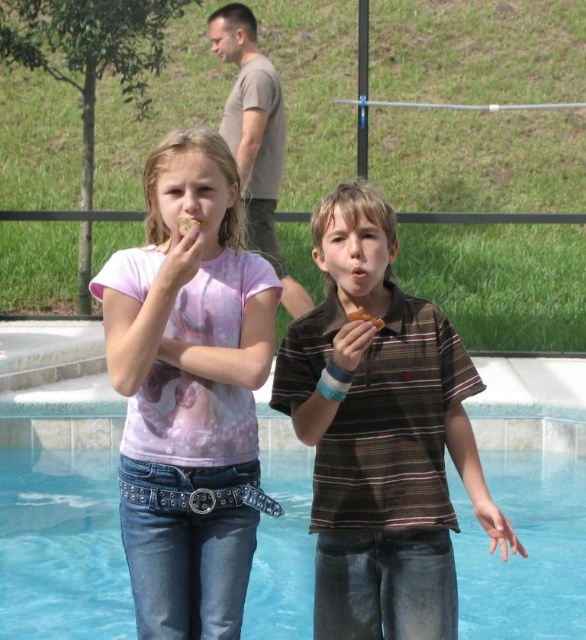
Is brown striped shirt at center in front of transparent glass water at lower center?

Yes, it is in front of transparent glass water at lower center.

Does brown striped shirt at center have a smaller size compared to transparent glass water at lower center?

Yes.

Image resolution: width=586 pixels, height=640 pixels. In order to click on brown striped shirt at center in this screenshot , I will do `click(380, 435)`.

Between transparent glass water at lower center and golden brown pastry at upper center, which one appears on the right side from the viewer's perspective?

From the viewer's perspective, golden brown pastry at upper center appears more on the right side.

Identify the location of transparent glass water at lower center. (59, 538).

Which is in front, point (360, 310) or point (180, 218)?

Point (180, 218) is more forward.

Which is in front, point (349, 317) or point (195, 225)?

Point (195, 225) is more forward.

This screenshot has width=586, height=640. What are the coordinates of `golden brown pastry at upper center` in the screenshot? It's located at (364, 317).